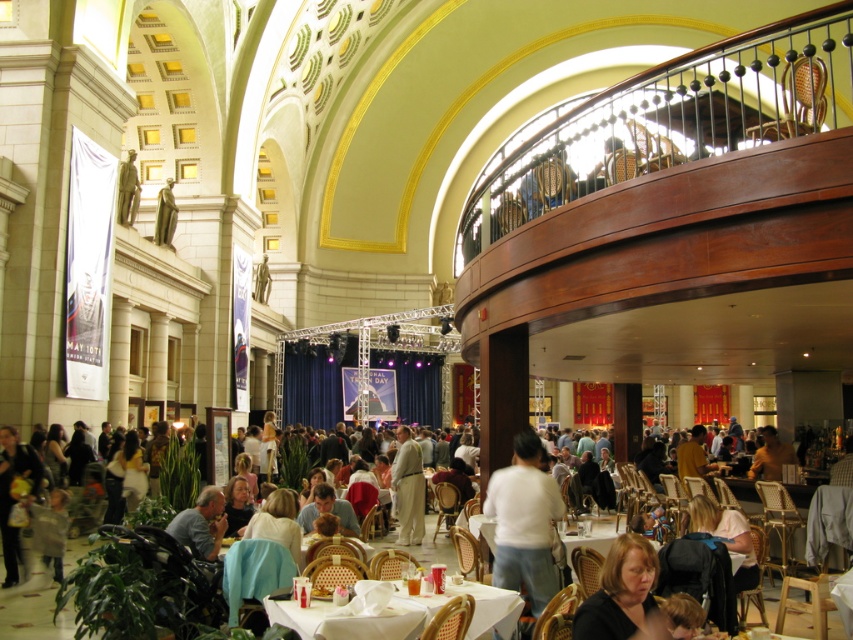
Question: Where is light beige fabric suit at center located in relation to yellow shirt at center in the image?

Choices:
 (A) right
 (B) left

Answer: (B)

Question: Which is farther from the blonde hair at lower center?

Choices:
 (A) white cotton shirt at center
 (B) light beige fabric suit at center
 (C) white cloth table at lower center

Answer: (B)

Question: Can you confirm if yellow shirt at center is thinner than bronze statue at upper center?

Choices:
 (A) yes
 (B) no

Answer: (B)

Question: Does white cotton shirt at center appear on the right side of white cloth table at lower center?

Choices:
 (A) no
 (B) yes

Answer: (B)

Question: Which of the following is the farthest from the observer?

Choices:
 (A) (170, 209)
 (B) (204, 532)

Answer: (A)

Question: Among these points, which one is farthest from the camera?

Choices:
 (A) (753, 467)
 (B) (370, 625)

Answer: (A)